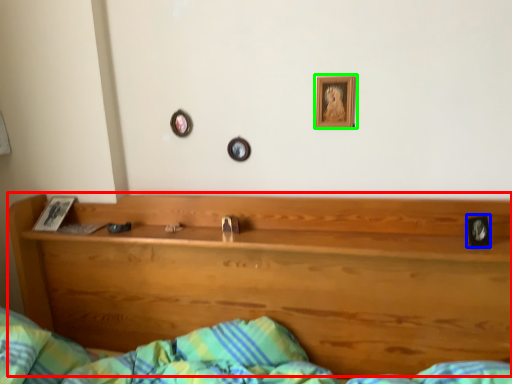
Question: Considering the real-world distances, which object is closest to bunk bed (highlighted by a red box)? picture frame (highlighted by a blue box) or picture frame (highlighted by a green box).

Choices:
 (A) picture frame
 (B) picture frame

Answer: (B)